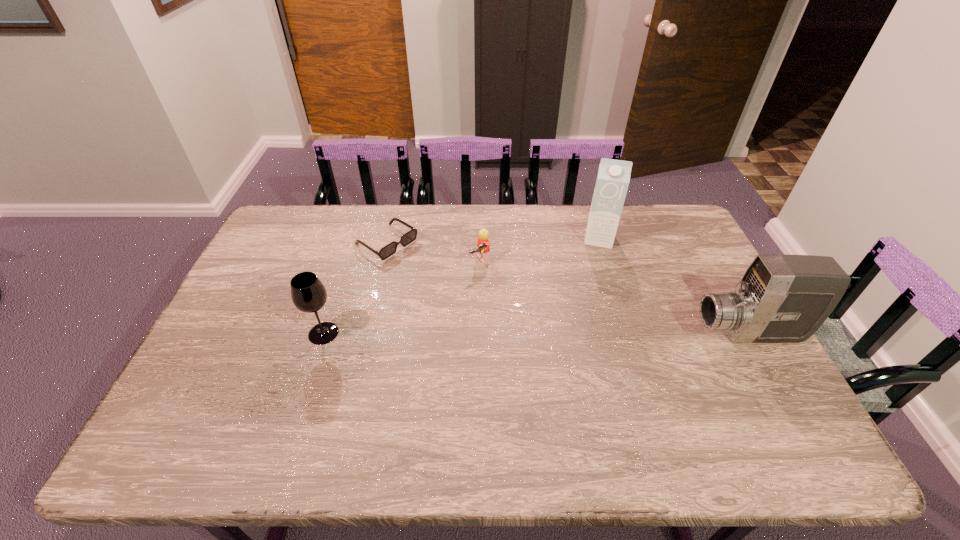
The image size is (960, 540). Identify the location of free point located 0.310m on the front label of the carton. (589, 315).

Identify the location of sunglasses present at the far edge. The height and width of the screenshot is (540, 960). (390, 249).

Find the location of a particular element. The width and height of the screenshot is (960, 540). carton positioned at the far edge is located at coordinates (613, 177).

Image resolution: width=960 pixels, height=540 pixels. I want to click on object present at the right edge, so click(x=781, y=298).

Image resolution: width=960 pixels, height=540 pixels. Identify the location of vacant space at the far edge of the desktop. (516, 213).

Find the location of a particular element. Image resolution: width=960 pixels, height=540 pixels. vacant space at the left edge of the desktop is located at coordinates (270, 249).

At what (x,y) coordinates should I click in order to perform the action: click on free region at the right edge of the desktop. Please return your answer as a coordinate pair (x, y). Looking at the image, I should click on (679, 280).

Where is `free space at the far left corner`? The height and width of the screenshot is (540, 960). free space at the far left corner is located at coordinates (304, 212).

This screenshot has height=540, width=960. I want to click on vacant space at the far right corner of the desktop, so click(684, 233).

Where is `vacant area at the near right corner`? vacant area at the near right corner is located at coordinates (710, 386).